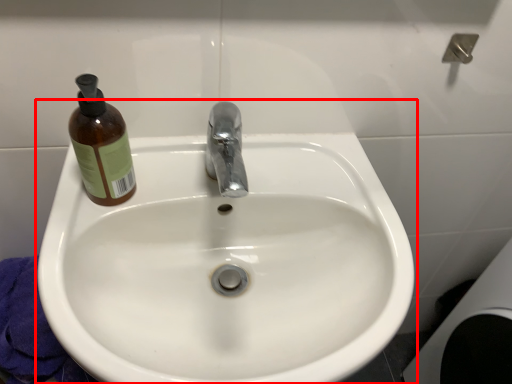
Question: From the image's perspective, considering the relative positions of sink (annotated by the red box) and bottle in the image provided, where is sink (annotated by the red box) located with respect to the staircase?

Choices:
 (A) above
 (B) below

Answer: (B)